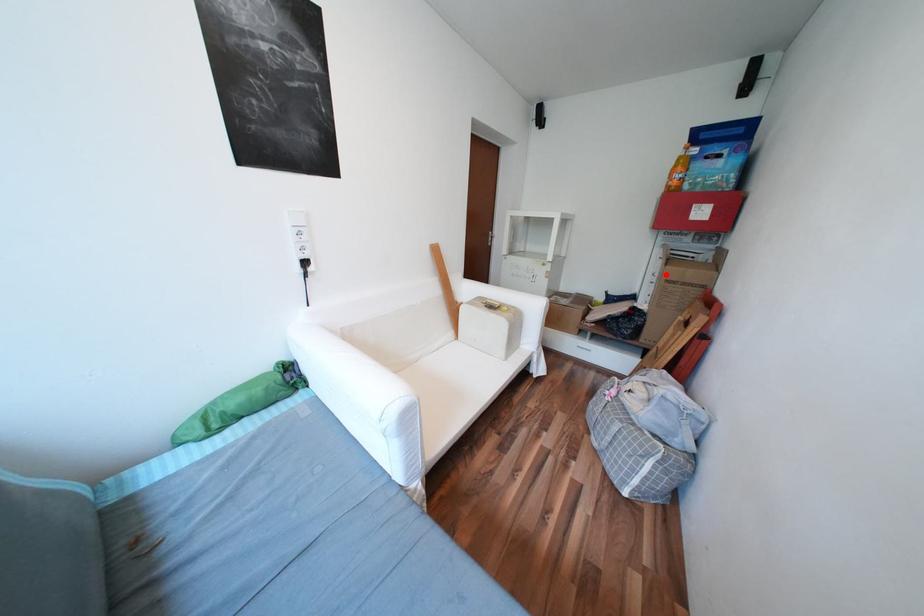
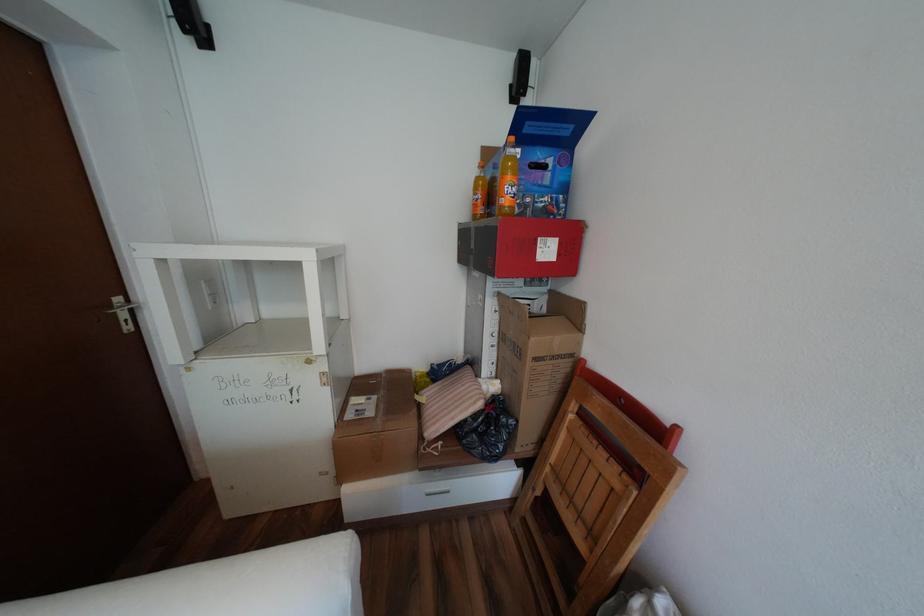
Locate, in the second image, the point that corresponds to the highlighted location in the first image.

(505, 334)